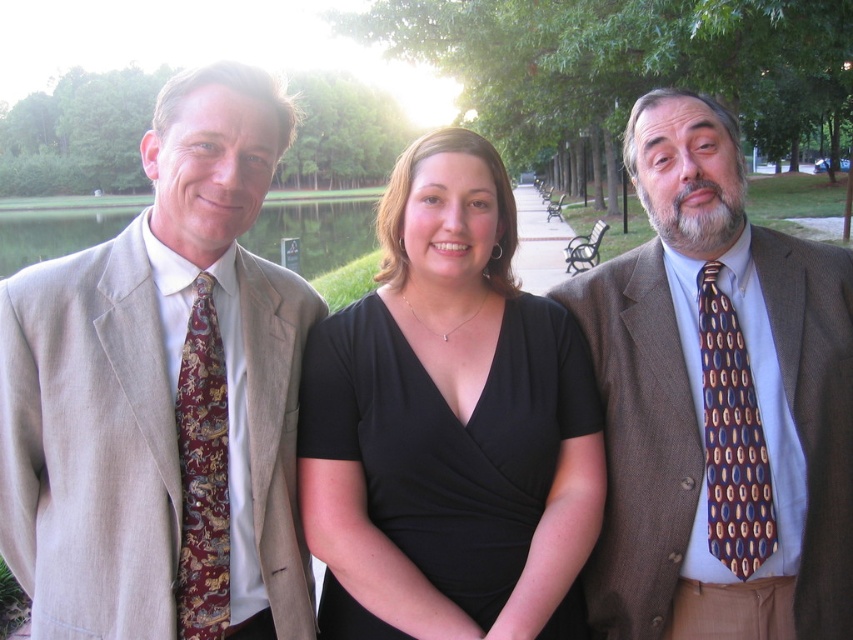
Question: Which of the following is the farthest from the observer?

Choices:
 (A) (767, 548)
 (B) (604, 365)
 (C) (506, 563)

Answer: (B)

Question: Which of the following is the closest to the observer?

Choices:
 (A) black metal park bench at center
 (B) black satin dress at center
 (C) brown silk tie at right

Answer: (B)

Question: Which of these objects is positioned closest to the wooden park bench at center?

Choices:
 (A) black satin dress at center
 (B) light beige suit at left

Answer: (A)

Question: Can you confirm if black satin dress at center is positioned above wooden park bench at center?

Choices:
 (A) no
 (B) yes

Answer: (A)

Question: Can you confirm if burgundy silk tie at left is positioned to the right of brown silk tie at right?

Choices:
 (A) yes
 (B) no

Answer: (B)

Question: Is light beige suit at left positioned before brown textured suit at right?

Choices:
 (A) no
 (B) yes

Answer: (B)